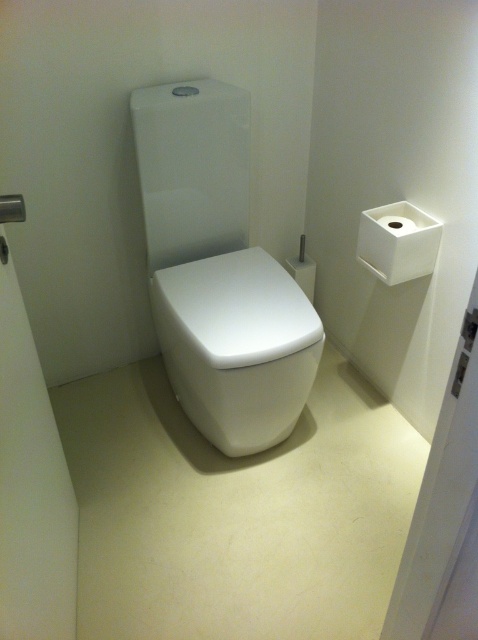
Question: Which object is the closest to the white glossy toilet bowl at center?

Choices:
 (A) white matte tissue at right
 (B) white matte toilet paper at upper right

Answer: (A)

Question: Is white matte tissue at right to the left of white matte toilet paper at upper right from the viewer's perspective?

Choices:
 (A) no
 (B) yes

Answer: (B)

Question: Is white glossy toilet bowl at center smaller than white matte tissue at right?

Choices:
 (A) no
 (B) yes

Answer: (A)

Question: Based on their relative distances, which object is nearer to the white matte toilet paper at upper right?

Choices:
 (A) white glossy toilet bowl at center
 (B) white matte tissue at right

Answer: (B)

Question: Considering the relative positions of white glossy toilet bowl at center and white matte toilet paper at upper right in the image provided, where is white glossy toilet bowl at center located with respect to white matte toilet paper at upper right?

Choices:
 (A) above
 (B) below

Answer: (B)

Question: Among these points, which one is nearest to the camera?

Choices:
 (A) (201, 420)
 (B) (425, 225)

Answer: (B)